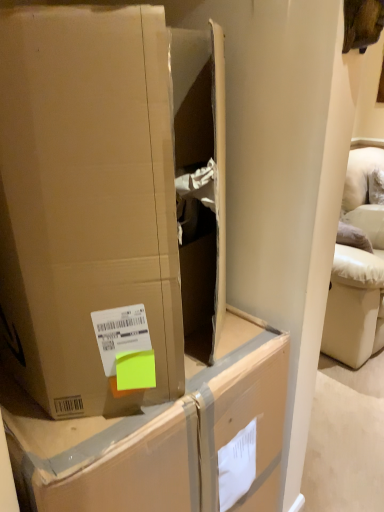
Find the location of `cardboard box at center`. cardboard box at center is located at coordinates (157, 439).

Describe the element at coordinates (157, 439) in the screenshot. I see `cardboard box at center` at that location.

Identify the location of cardboard box at center. (157, 439).